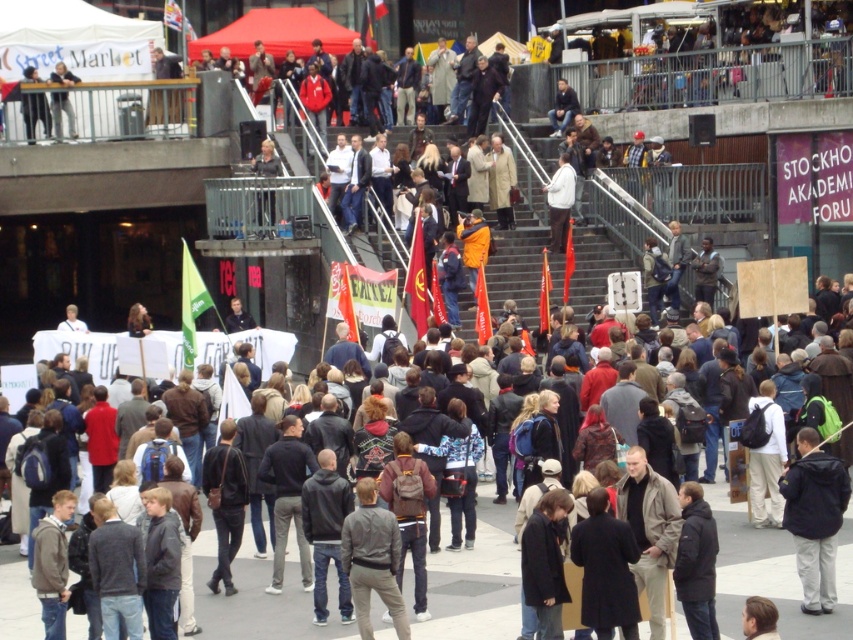
Consider the image. Is dark gray sweater at center taller than black leather jacket at center?

No, dark gray sweater at center is not taller than black leather jacket at center.

What do you see at coordinates (372, 560) in the screenshot?
I see `dark gray sweater at center` at bounding box center [372, 560].

Describe the element at coordinates (372, 560) in the screenshot. I see `dark gray sweater at center` at that location.

This screenshot has width=853, height=640. Identify the location of dark gray sweater at center. (372, 560).

Consider the image. Is dark gray jacket at upper left further to the viewer compared to matte black camera at upper left?

That is False.

Is dark gray jacket at upper left taller than matte black camera at upper left?

Correct, dark gray jacket at upper left is much taller as matte black camera at upper left.

The height and width of the screenshot is (640, 853). Identify the location of dark gray jacket at upper left. (33, 113).

Is black fabric jacket at lower right above white matte jacket at center?

Actually, black fabric jacket at lower right is below white matte jacket at center.

Is point (817, 444) positioned in front of point (570, 198)?

That is True.

Identify the location of black fabric jacket at lower right. (814, 518).